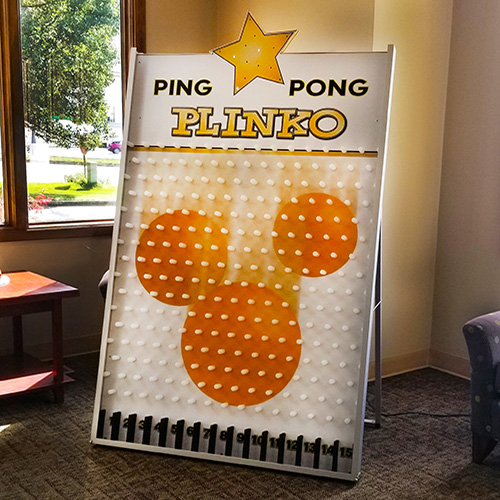
Where is `easel frame`? The height and width of the screenshot is (500, 500). easel frame is located at coordinates (378, 317).